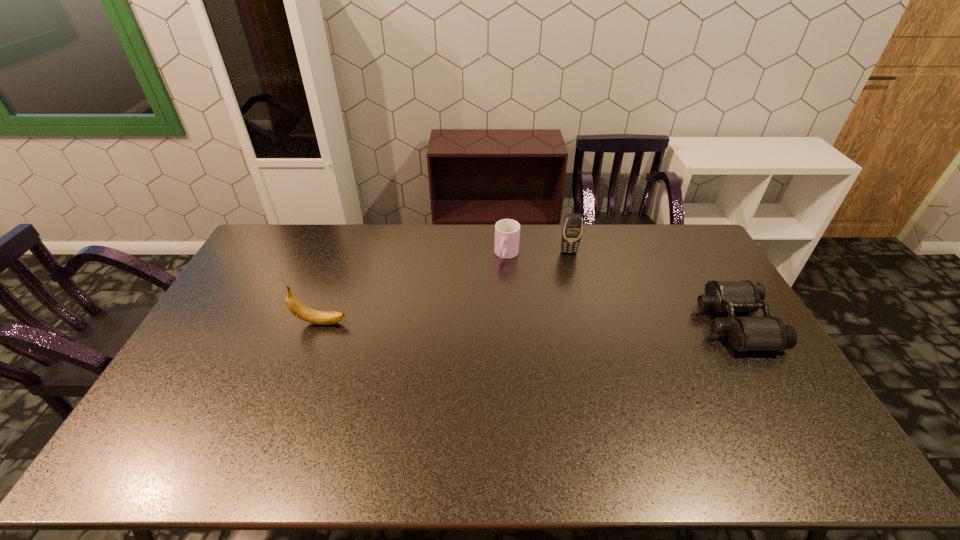
This screenshot has width=960, height=540. Identify the location of free space on the desktop that is between the banana and the binoculars and is positioned on the front face of the second object from right to left. (586, 323).

In order to click on free space on the desktop that is between the leftmost object and the shortest object and is positioned with the handle on the side of the second object from left to right in this screenshot , I will do `click(476, 323)`.